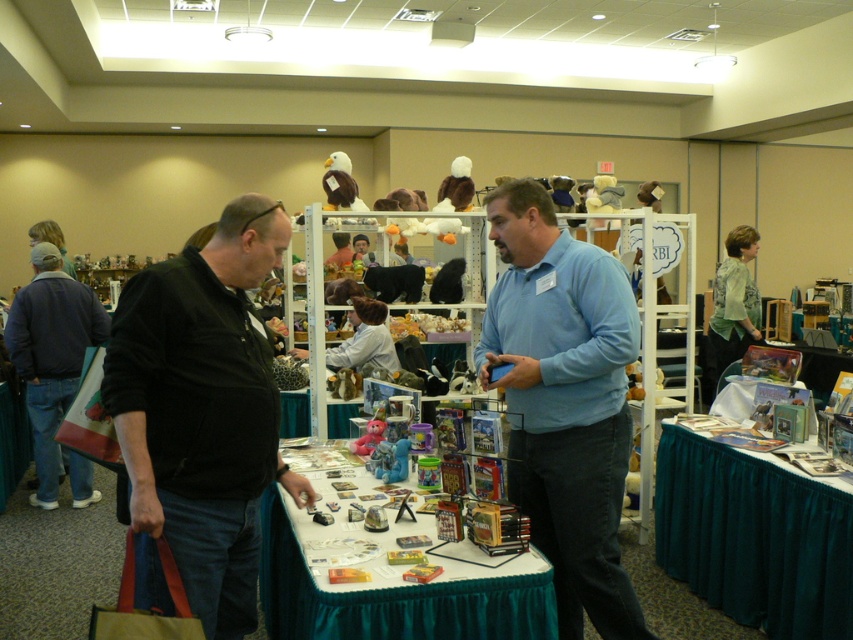
Who is taller, blue cotton shirt at center or blue rubber toy at center?

blue cotton shirt at center is taller.

Can you confirm if blue cotton shirt at center is positioned above blue rubber toy at center?

Yes, blue cotton shirt at center is above blue rubber toy at center.

Which is behind, point (602, 481) or point (404, 472)?

The point (404, 472) is behind.

The width and height of the screenshot is (853, 640). I want to click on blue cotton shirt at center, so click(564, 401).

This screenshot has width=853, height=640. What do you see at coordinates (456, 188) in the screenshot? I see `white plush duck at center` at bounding box center [456, 188].

Locate an element on the screen. This screenshot has height=640, width=853. white plush duck at center is located at coordinates (456, 188).

Does black corduroy jacket at left have a greater width compared to blue rubber toy at center?

Indeed, black corduroy jacket at left has a greater width compared to blue rubber toy at center.

Is point (144, 467) behind point (398, 481)?

No, it is not.

You are a GUI agent. You are given a task and a screenshot of the screen. Output one action in this format:
    pyautogui.click(x=<x>, y=<y>)
    Task: Click on the black corduroy jacket at left
    This screenshot has width=853, height=640.
    Given the screenshot: What is the action you would take?
    (x=200, y=417)

The height and width of the screenshot is (640, 853). I want to click on black corduroy jacket at left, so click(x=200, y=417).